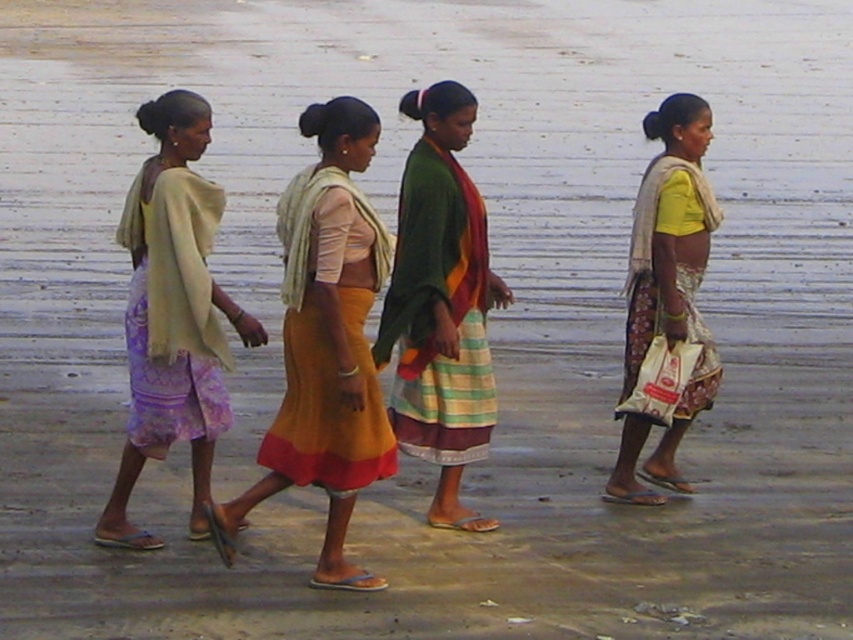
You are standing in front of the group of women walking on the wet sandy surface. You need to determine which of the two points, point [410,390] or point [283,280], is closer to you. Which one is closer?

Point [410,390] is closer to the viewer than point [283,280].